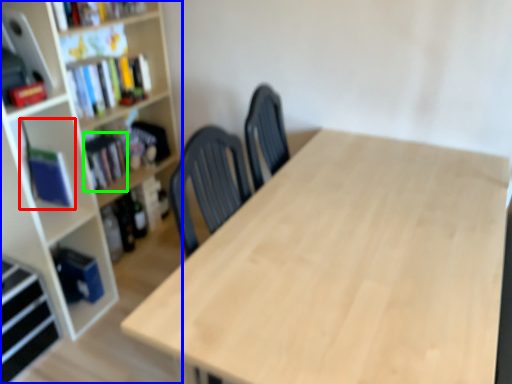
Question: Which is farther away from book (highlighted by a red box)? bookcase (highlighted by a blue box) or book (highlighted by a green box)?

Choices:
 (A) bookcase
 (B) book

Answer: (B)